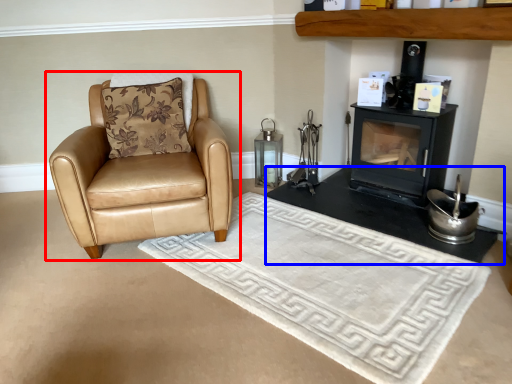
Question: Which object appears closest to the camera in this image, chair (highlighted by a red box) or table (highlighted by a blue box)?

Choices:
 (A) chair
 (B) table

Answer: (A)